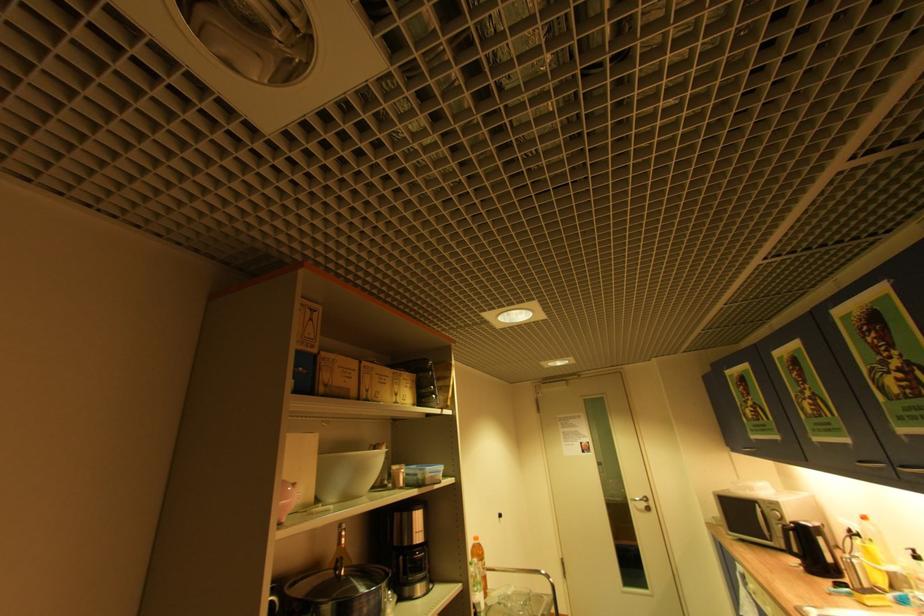
What do you see at coordinates (853, 540) in the screenshot? I see `the yellow bottle pump` at bounding box center [853, 540].